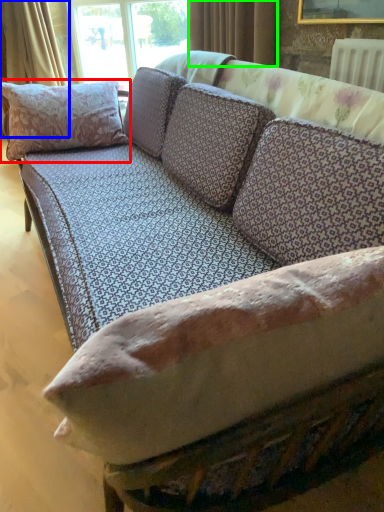
Question: Based on their relative distances, which object is farther from pillow (highlighted by a red box)? Choose from curtain (highlighted by a blue box) and curtain (highlighted by a green box).

Choices:
 (A) curtain
 (B) curtain

Answer: (A)